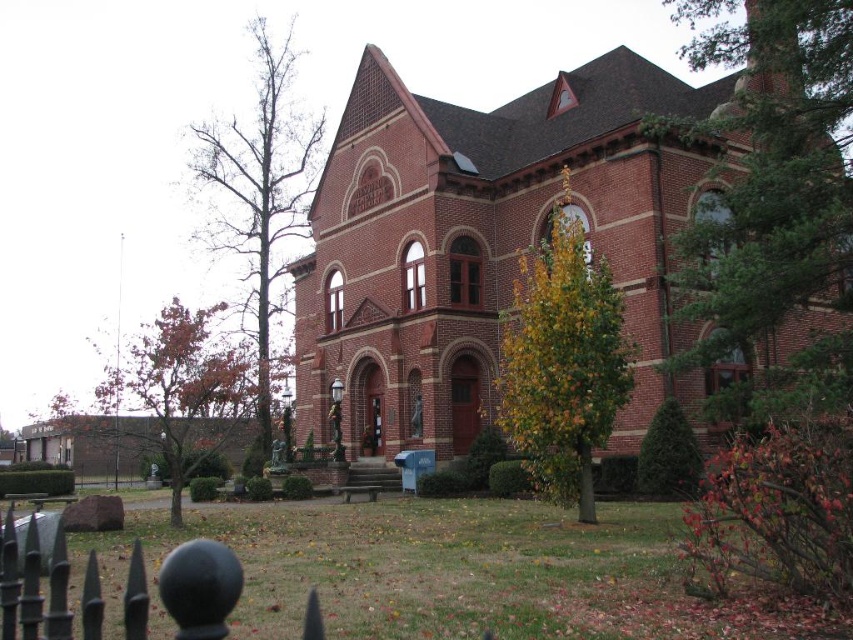
Question: Which is nearer to the green leafy tree at right?

Choices:
 (A) yellow-green leaves at center
 (B) brown leafy tree at left
 (C) black wrought iron fence at lower left

Answer: (A)

Question: Does red brick church at center have a larger size compared to green leafy tree at right?

Choices:
 (A) yes
 (B) no

Answer: (B)

Question: Which point is farther from the camera taking this photo?

Choices:
 (A) (160, 460)
 (B) (576, 376)
 (C) (305, 154)

Answer: (C)

Question: Can you confirm if green leafy tree at right is positioned to the left of brown leafy tree at left?

Choices:
 (A) no
 (B) yes

Answer: (A)

Question: Which point is farther to the camera?

Choices:
 (A) brown leafy tree at left
 (B) red brick church at center
 (C) bare wood tree at left

Answer: (C)

Question: Can you confirm if red brick church at center is smaller than yellow-green leaves at center?

Choices:
 (A) no
 (B) yes

Answer: (A)